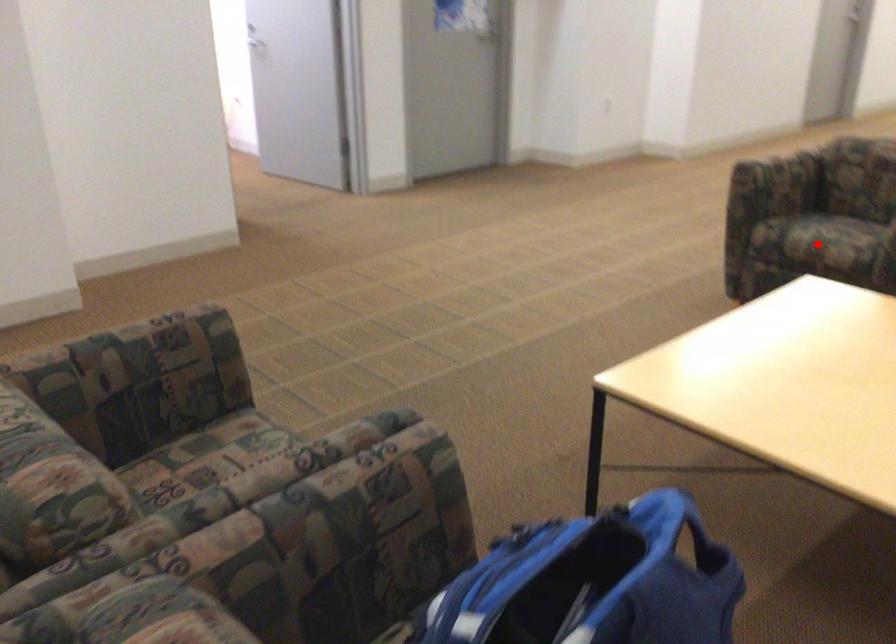
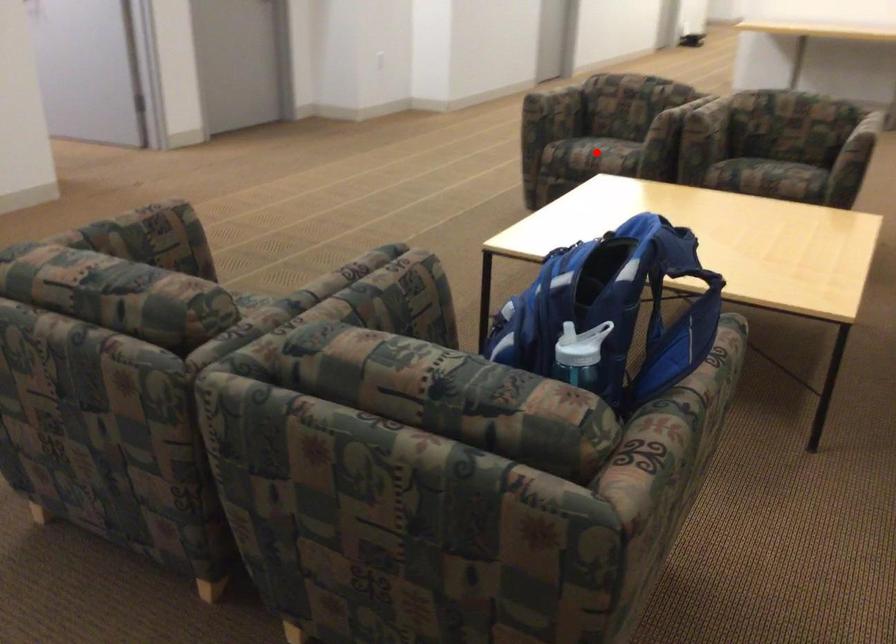
I am providing you with two images of the same scene from different viewpoints. A red point is marked on the first image and another point is marked on the second image. Do the highlighted points in image1 and image2 indicate the same real-world spot?

Yes